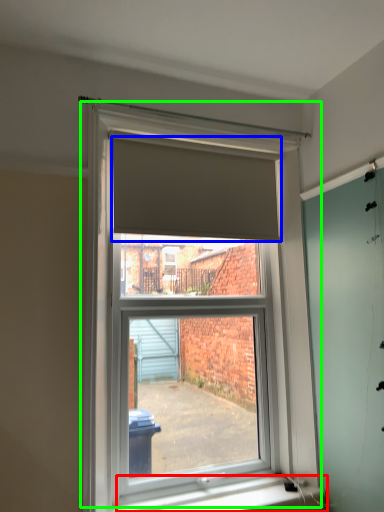
Question: Which object is the closest to the window sill (highlighted by a red box)? Choose among these: blind (highlighted by a blue box) or window (highlighted by a green box).

Choices:
 (A) blind
 (B) window

Answer: (B)